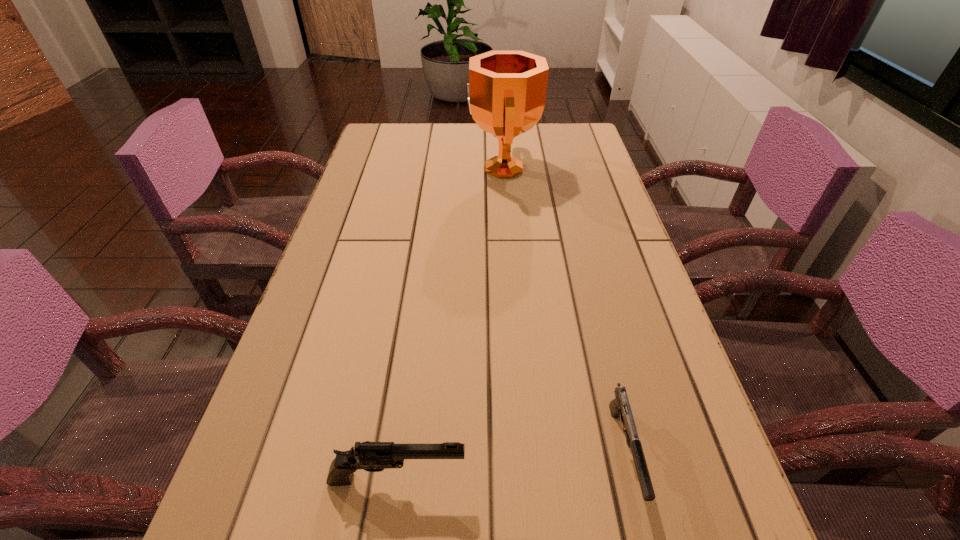
At what (x,y) coordinates should I click in order to perform the action: click on object present at the far edge. Please return your answer as a coordinate pair (x, y). The width and height of the screenshot is (960, 540). Looking at the image, I should click on (506, 95).

I want to click on object that is positioned at the left edge, so click(370, 456).

This screenshot has height=540, width=960. Identify the location of object situated at the right edge. (619, 407).

The height and width of the screenshot is (540, 960). Find the location of `blank space at the far edge`. blank space at the far edge is located at coordinates (453, 132).

At what (x,y) coordinates should I click in order to perform the action: click on free point at the left edge. Please return your answer as a coordinate pair (x, y). Looking at the image, I should click on (354, 320).

At what (x,y) coordinates should I click in order to perform the action: click on free space at the right edge of the desktop. Please return your answer as a coordinate pair (x, y). The width and height of the screenshot is (960, 540). Looking at the image, I should click on (585, 180).

Find the location of `free space at the far right corner of the desktop`. free space at the far right corner of the desktop is located at coordinates (586, 138).

This screenshot has width=960, height=540. Identify the location of vacant area that lies between the shortest object and the taller gun. point(511,465).

Where is `vacant point located between the farthest object and the left gun`? vacant point located between the farthest object and the left gun is located at coordinates (x=450, y=323).

Identify the location of empty space between the right gun and the left gun. (511, 465).